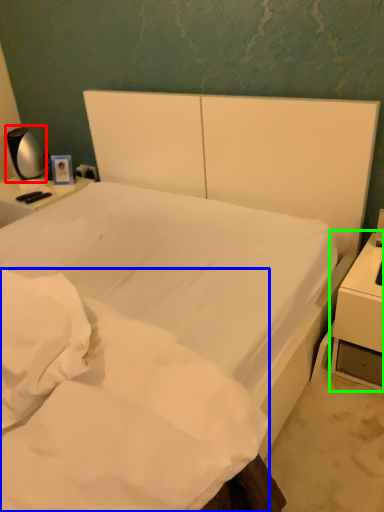
Question: Estimate the real-world distances between objects in this image. Which object is closer to bedside lamp (highlighted by a red box), mattress (highlighted by a blue box) or nightstand (highlighted by a green box)?

Choices:
 (A) mattress
 (B) nightstand

Answer: (A)